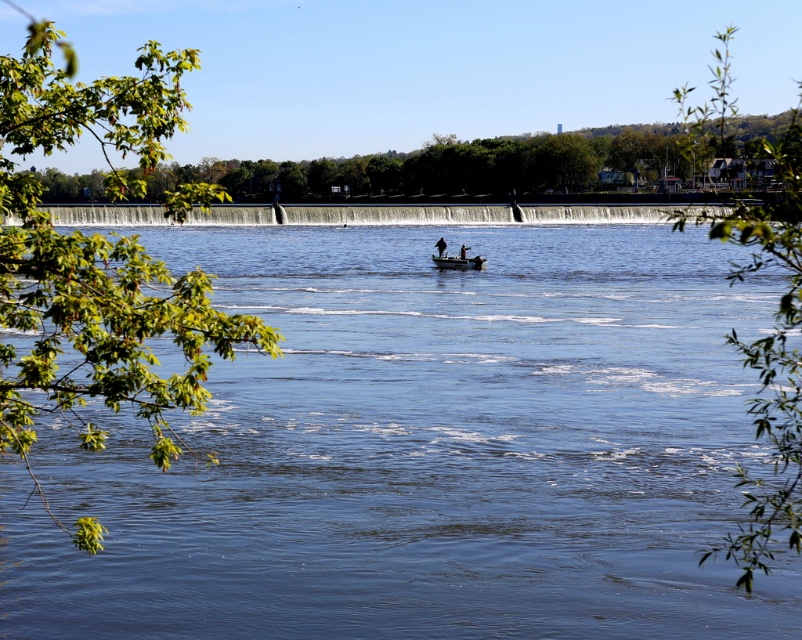
You are an observer standing on the riverside. You see the green leafy branch at upper right and the matte black boat at center. Which object is higher in the scene?

The green leafy branch at upper right is higher in the scene than the matte black boat at center because it is located above it.

You are planning to paddle a canoe that is 1.2 meters wide. Looking at the scene, can you determine if the space between the green leafy branch at upper right and the matte black canoe at center is wide enough for your canoe to pass through?

The green leafy branch at upper right might be wider than matte black canoe at center, so the space between them may be sufficient for your 1.2 meter wide canoe to pass through, but there is uncertainty due to the possible width difference.

You are a photographer planning to take a photo of the matte black canoe at center. You want to ensure that the green leafy branch at upper right does not block the view of the canoe. Is the branch positioned in a way that it might obstruct the canoe in your photo?

The green leafy branch at upper right is located above the matte black canoe at center, so it might obstruct the view of the canoe in your photo.